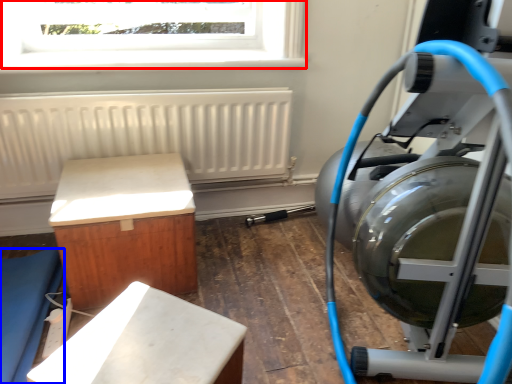
Question: Which object is closer to the camera taking this photo, window (highlighted by a red box) or furniture (highlighted by a blue box)?

Choices:
 (A) window
 (B) furniture

Answer: (B)